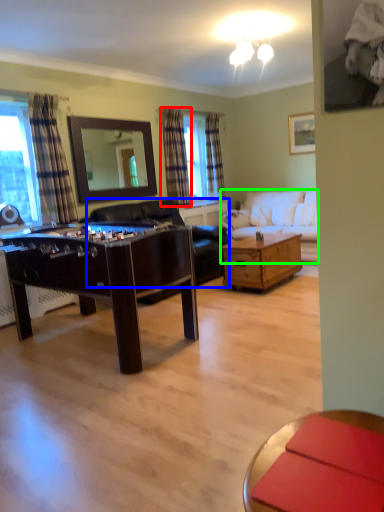
Question: Which object is positioned closest to curtain (highlighted by a red box)? Select from futon (highlighted by a blue box) and studio couch (highlighted by a green box).

Choices:
 (A) futon
 (B) studio couch

Answer: (A)